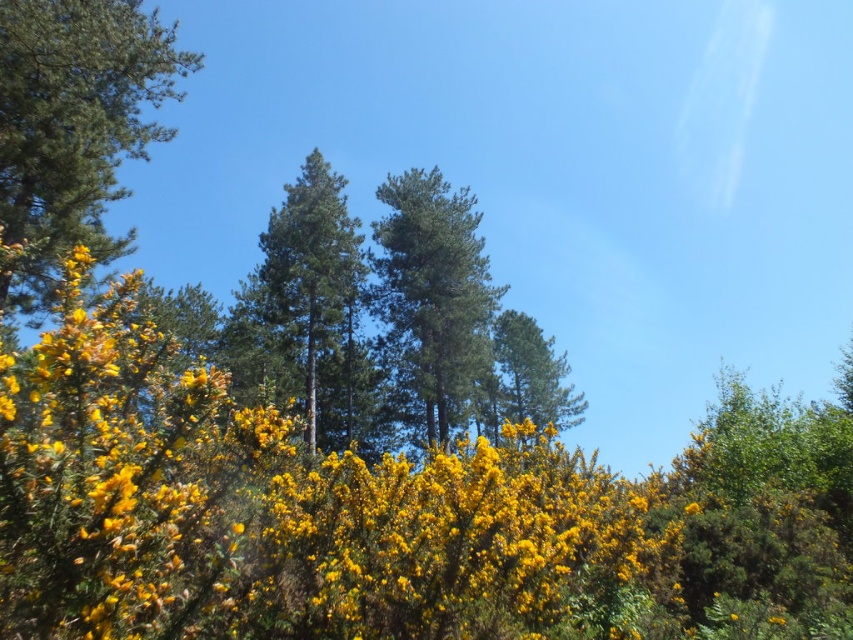
Can you confirm if green matte tree at center is taller than green textured tree at center?

Indeed, green matte tree at center has a greater height compared to green textured tree at center.

Does green matte tree at center lie in front of green textured tree at center?

Yes, green matte tree at center is closer to the viewer.

Is point (424, 365) behind point (521, 349)?

No, it is in front of (521, 349).

Where is `green matte tree at center`? This screenshot has height=640, width=853. green matte tree at center is located at coordinates (432, 298).

Is yellow fluffy bush at center to the right of green matte tree at center from the viewer's perspective?

Incorrect, yellow fluffy bush at center is not on the right side of green matte tree at center.

Which of these two, yellow fluffy bush at center or green matte tree at center, stands taller?

green matte tree at center is taller.

Who is more distant from viewer, (819, 515) or (399, 371)?

Positioned behind is point (399, 371).

At what (x,y) coordinates should I click in order to perform the action: click on yellow fluffy bush at center. Please return your answer as a coordinate pair (x, y). Looking at the image, I should click on (387, 513).

Is green needle-like at upper left closer to camera compared to green textured pine tree at center?

Yes, it is.

Does green needle-like at upper left have a greater height compared to green textured pine tree at center?

No.

Between point (65, 4) and point (288, 195), which one is positioned behind?

The point (288, 195) is behind.

Image resolution: width=853 pixels, height=640 pixels. I want to click on green needle-like at upper left, so (x=73, y=125).